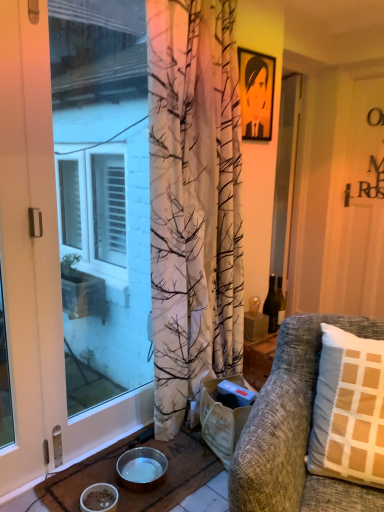
Question: Considering their positions, is translucent glass bottle at center right located in front of or behind textured gray couch at right?

Choices:
 (A) behind
 (B) front

Answer: (A)

Question: Considering the positions of translucent glass bottle at center right and textured gray couch at right in the image, is translucent glass bottle at center right taller or shorter than textured gray couch at right?

Choices:
 (A) short
 (B) tall

Answer: (A)

Question: Which of these objects is positioned farthest from the textured gray couch at right?

Choices:
 (A) matte black picture frame at upper center
 (B) transparent glass screen door at center, the first screen door viewed from the right
 (C) translucent glass bottle at center right
 (D) metallic silver bowl at lower center, the first bowl from the back
 (E) brown woven mat at lower left

Answer: (B)

Question: Which is nearer to the matte white door at left?

Choices:
 (A) white matte bowl at lower left, which appears as the 1th bowl when viewed from the front
 (B) metallic silver bowl at lower center, which is counted as the 2th bowl, starting from the front
 (C) translucent glass bottle at center right
 (D) brown woven mat at lower left
 (E) transparent glass screen door at center, the first screen door viewed from the right

Answer: (D)